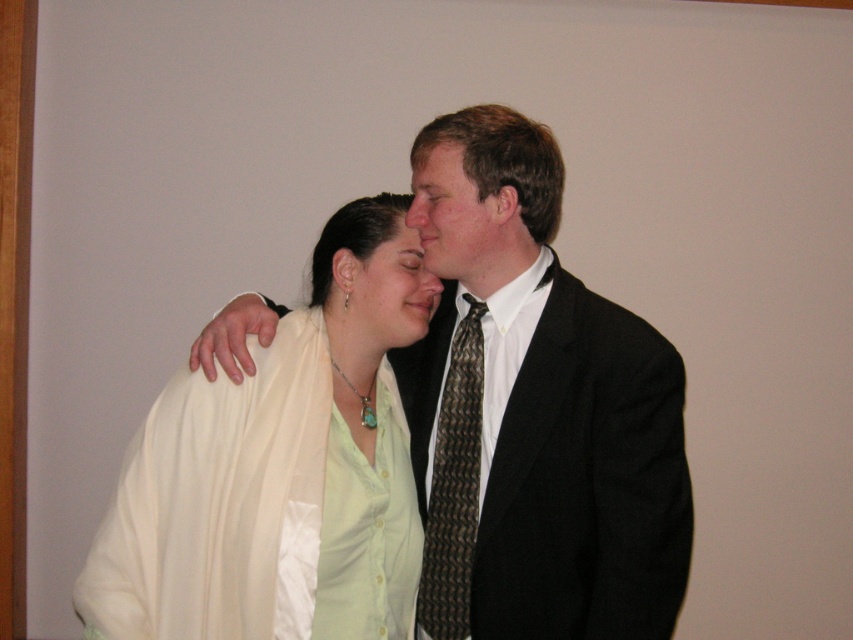
Question: Which point is farther to the camera?

Choices:
 (A) matte green shirt at center
 (B) brown woven tie at right
 (C) matte black suit at center
 (D) black textured suit at center

Answer: (A)

Question: Is black textured suit at center thinner than brown woven tie at right?

Choices:
 (A) no
 (B) yes

Answer: (A)

Question: Does light beige fabric at center appear under matte green shirt at center?

Choices:
 (A) no
 (B) yes

Answer: (B)

Question: Is brown woven tie at right behind matte green shirt at center?

Choices:
 (A) no
 (B) yes

Answer: (A)

Question: Which object is farther from the camera taking this photo?

Choices:
 (A) black textured suit at center
 (B) matte black hair at center
 (C) matte black suit at center
 (D) brown woven tie at right

Answer: (D)

Question: Which point is farther to the camera?

Choices:
 (A) light beige fabric at center
 (B) black textured suit at center
 (C) matte black hair at center

Answer: (C)